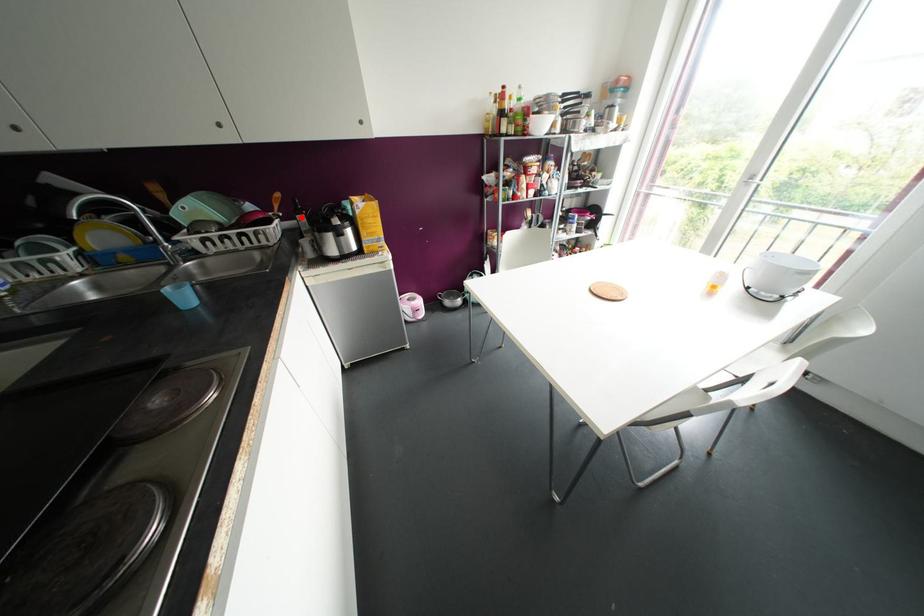
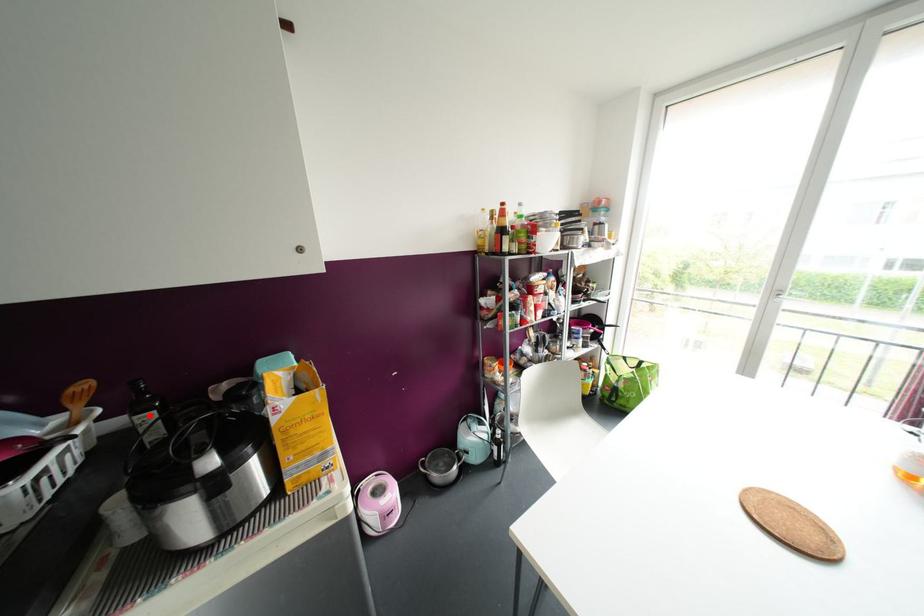
I am providing you with two images of the same scene from different viewpoints. A red point is marked on the first image and another point is marked on the second image. Do the highlighted points in image1 and image2 indicate the same real-world spot?

Yes